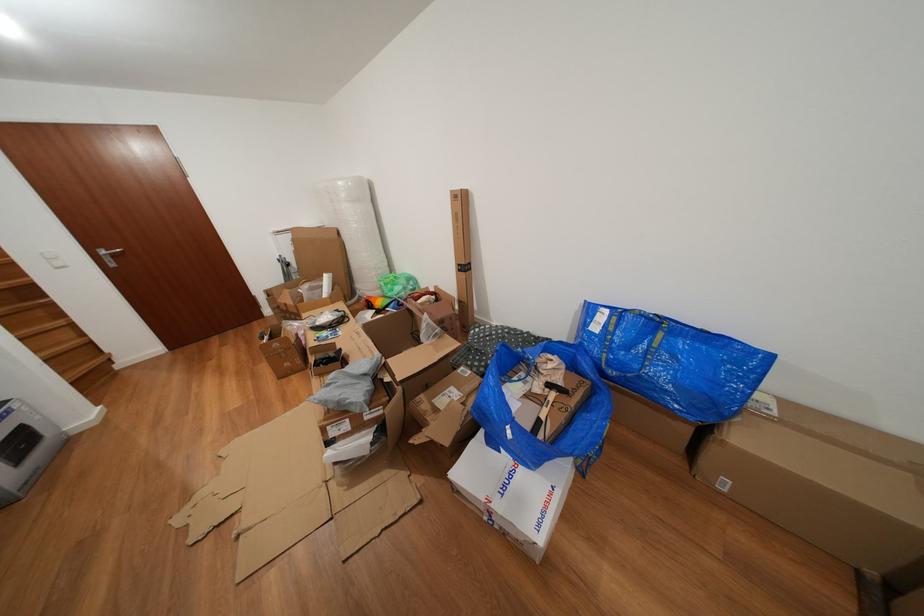
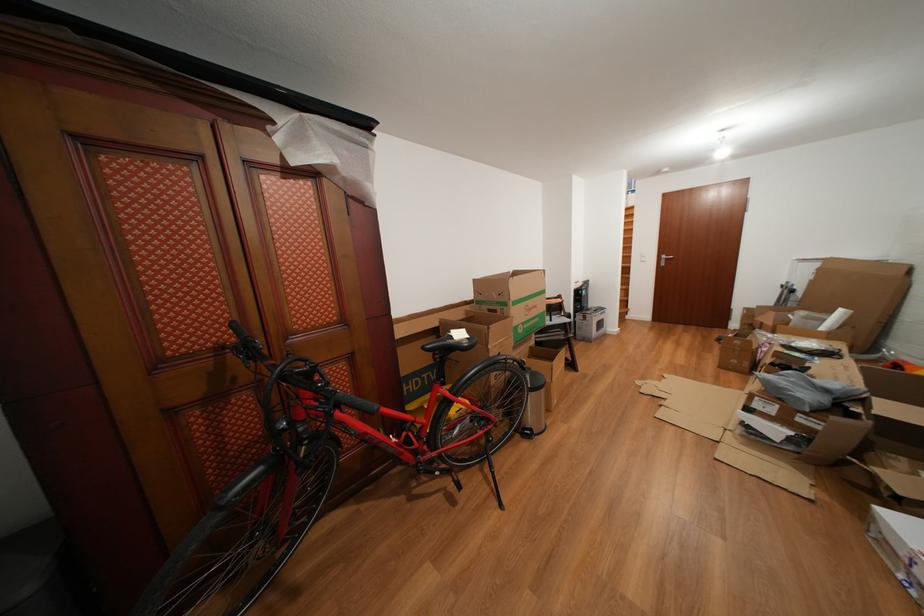
In the second image, find the point that corresponds to point (305, 257) in the first image.

(821, 288)